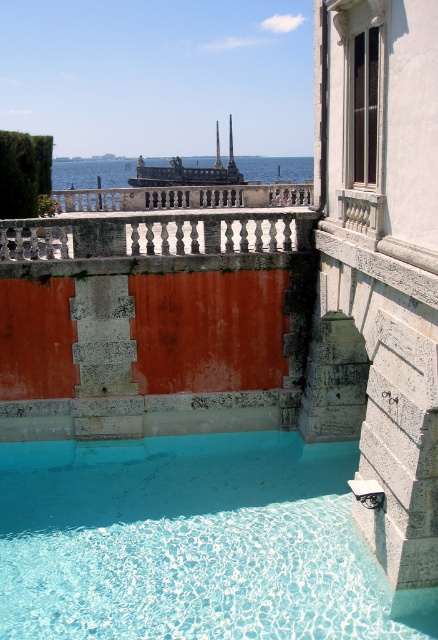
Question: Among these objects, which one is nearest to the camera?

Choices:
 (A) white stone balustrade at upper center
 (B) clear glass swimming pool at lower center
 (C) blue water at center

Answer: (A)

Question: Observing the image, what is the correct spatial positioning of clear glass swimming pool at lower center in reference to blue water at center?

Choices:
 (A) above
 (B) below

Answer: (B)

Question: Which of these objects is positioned closest to the clear glass swimming pool at lower center?

Choices:
 (A) white stone balustrade at upper center
 (B) blue water at center

Answer: (A)

Question: Among these points, which one is nearest to the camera?

Choices:
 (A) (95, 227)
 (B) (250, 513)

Answer: (B)

Question: Is clear glass swimming pool at lower center below white stone balustrade at upper center?

Choices:
 (A) yes
 (B) no

Answer: (A)

Question: From the image, what is the correct spatial relationship of clear glass swimming pool at lower center in relation to white stone balustrade at upper center?

Choices:
 (A) right
 (B) left

Answer: (B)